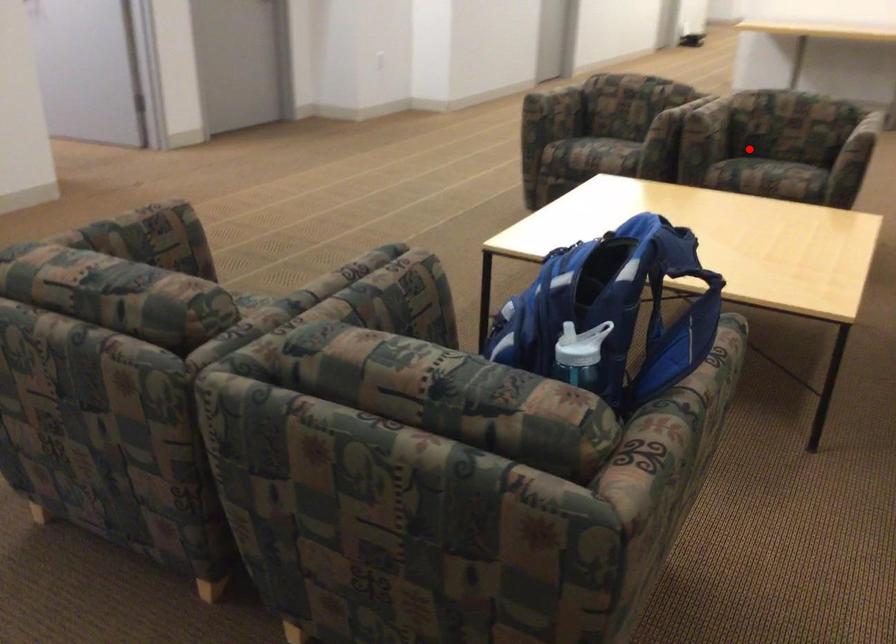
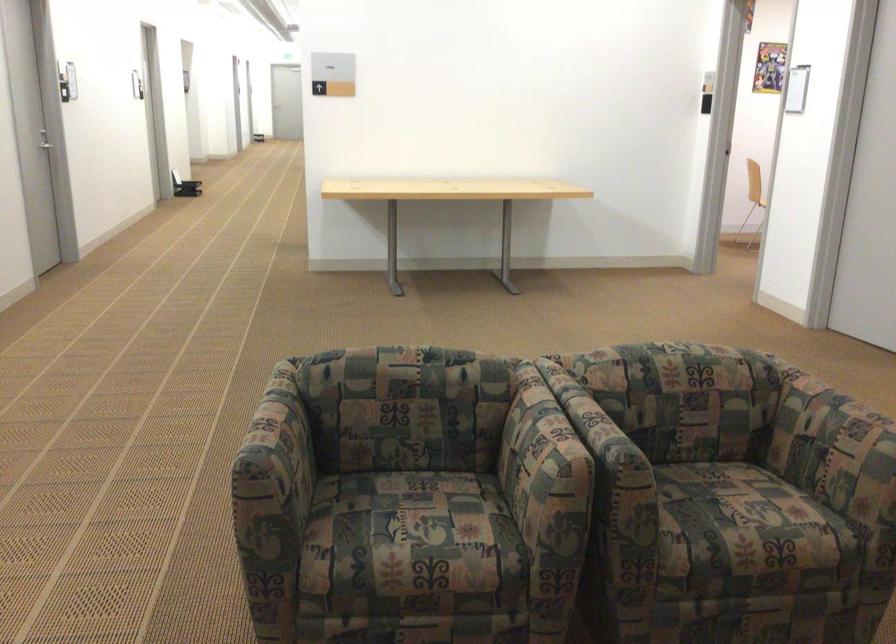
Question: I am providing you with two images of the same scene from different viewpoints. Image1 has a red point marked. In image2, the corresponding 3D location appears at what relative position? Reply with the corresponding letter.

Choices:
 (A) Closer
 (B) Farther

Answer: (A)